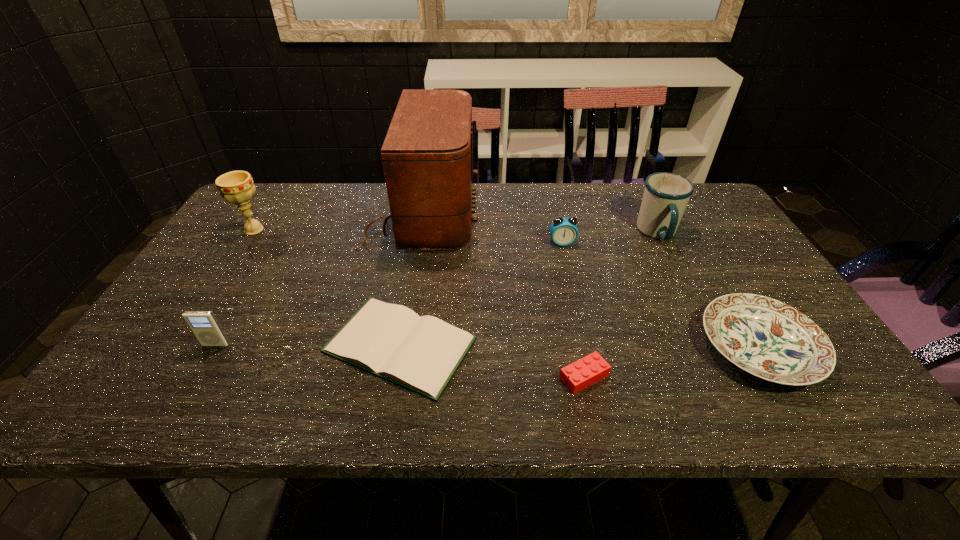
This screenshot has height=540, width=960. I want to click on plate located in the near edge section of the desktop, so click(x=767, y=338).

Find the location of a particular element. Lego that is at the near edge is located at coordinates (592, 368).

The width and height of the screenshot is (960, 540). In order to click on hardback book situated at the near edge in this screenshot , I will do `click(420, 353)`.

Find the location of a particular element. chalice located in the left edge section of the desktop is located at coordinates (237, 187).

Where is `iPod at the left edge`? Image resolution: width=960 pixels, height=540 pixels. iPod at the left edge is located at coordinates (204, 325).

Locate an element on the screen. object positioned at the right edge is located at coordinates (767, 338).

You are a GUI agent. You are given a task and a screenshot of the screen. Output one action in this format:
    pyautogui.click(x=<x>, y=<y>)
    Task: Click on the object that is at the far left corner
    
    Given the screenshot: What is the action you would take?
    pyautogui.click(x=237, y=187)

I want to click on object located in the near right corner section of the desktop, so click(767, 338).

The image size is (960, 540). Identify the location of free space at the far edge. (611, 188).

You are a GUI agent. You are given a task and a screenshot of the screen. Output one action in this format:
    pyautogui.click(x=<x>, y=<y>)
    Task: Click on the vacant space at the near edge of the desktop
    This screenshot has height=540, width=960.
    Given the screenshot: What is the action you would take?
    pyautogui.click(x=469, y=381)